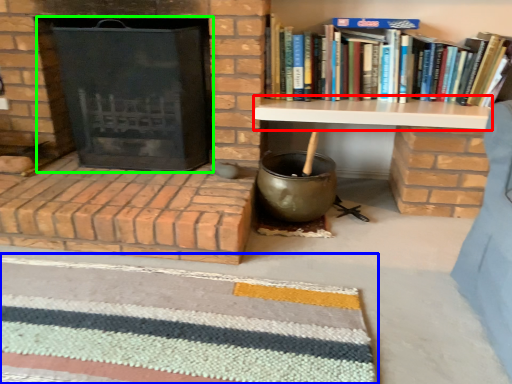
Question: Which object is the closest to the table (highlighted by a red box)? Choose among these: doormat (highlighted by a blue box) or fireplace (highlighted by a green box).

Choices:
 (A) doormat
 (B) fireplace

Answer: (B)